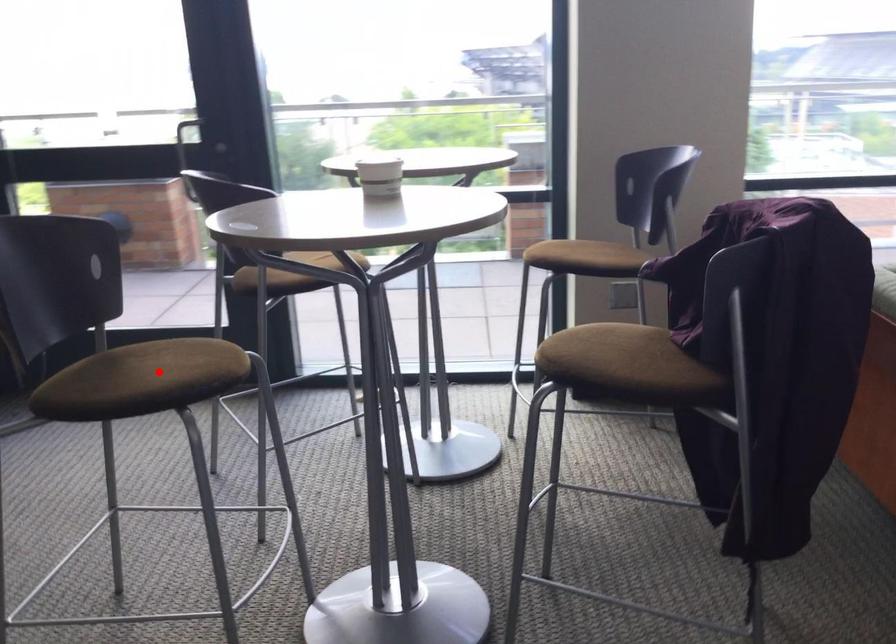
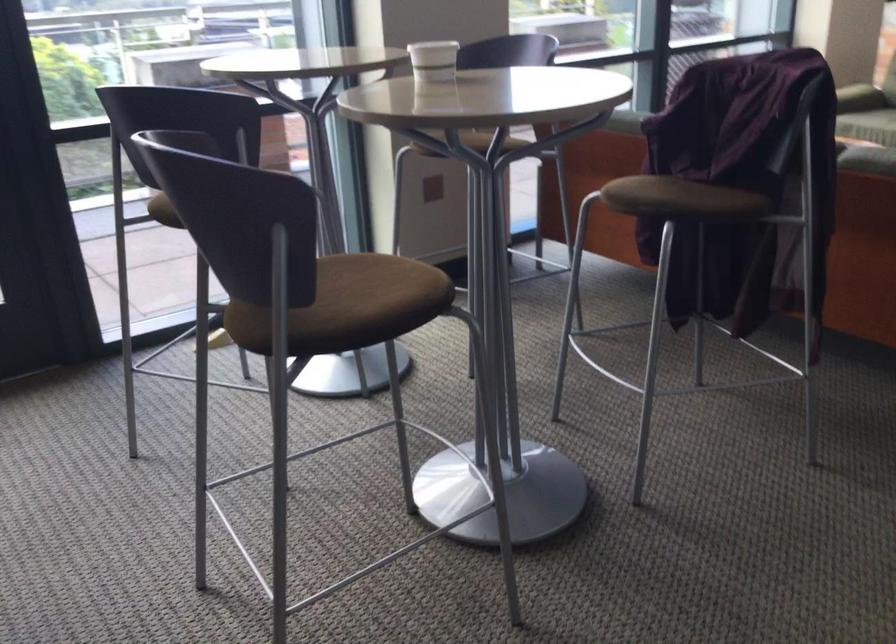
Locate, in the second image, the point that corresponds to the highlighted location in the first image.

(371, 292)